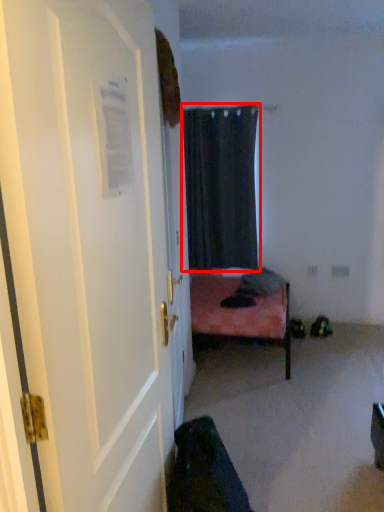
Question: From the image, what is the correct spatial relationship of curtain (annotated by the red box) in relation to door?

Choices:
 (A) right
 (B) left

Answer: (A)